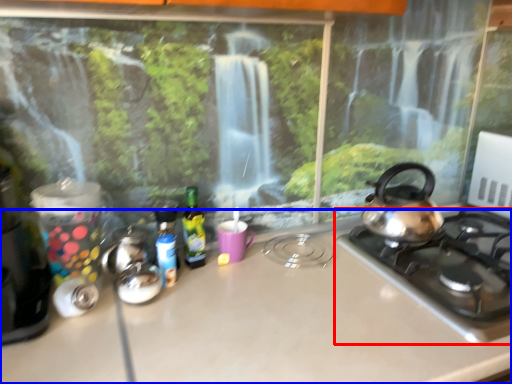
Question: Among these objects, which one is nearest to the camera, gas stove (highlighted by a red box) or countertop (highlighted by a blue box)?

Choices:
 (A) gas stove
 (B) countertop

Answer: (B)